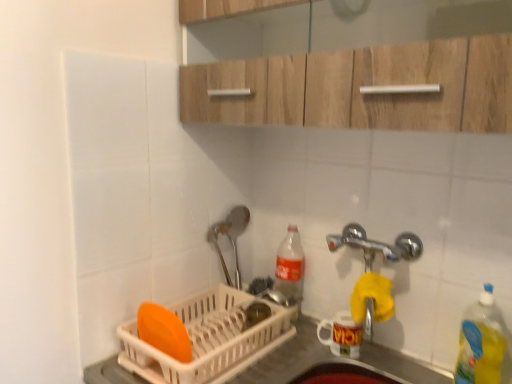
Question: Is yellow translucent bottle at right, the first bottle positioned from the right, outside of white plastic dish rack at lower left?

Choices:
 (A) yes
 (B) no

Answer: (A)

Question: Is yellow translucent bottle at right, placed as the 2th bottle when sorted from back to front, further to the viewer compared to white plastic dish rack at lower left?

Choices:
 (A) yes
 (B) no

Answer: (A)

Question: Is yellow translucent bottle at right, the first bottle positioned from the right, touching white plastic dish rack at lower left?

Choices:
 (A) no
 (B) yes

Answer: (A)

Question: From the image's perspective, does yellow translucent bottle at right, the 2th bottle positioned from the left, appear lower than white plastic dish rack at lower left?

Choices:
 (A) no
 (B) yes

Answer: (A)

Question: Does yellow translucent bottle at right, placed as the 2th bottle when sorted from back to front, have a lesser height compared to white plastic dish rack at lower left?

Choices:
 (A) yes
 (B) no

Answer: (B)

Question: Relative to white plastic dish rack at lower left, is wooden cabinet at upper center in front or behind?

Choices:
 (A) front
 (B) behind

Answer: (A)

Question: From their relative heights in the image, would you say wooden cabinet at upper center is taller or shorter than white plastic dish rack at lower left?

Choices:
 (A) tall
 (B) short

Answer: (A)

Question: Considering the positions of wooden cabinet at upper center and white plastic dish rack at lower left in the image, is wooden cabinet at upper center bigger or smaller than white plastic dish rack at lower left?

Choices:
 (A) big
 (B) small

Answer: (A)

Question: Is wooden cabinet at upper center to the left or to the right of white plastic dish rack at lower left in the image?

Choices:
 (A) left
 (B) right

Answer: (B)

Question: Considering the positions of white plastic dish rack at lower left and yellow translucent bottle at right, the first bottle positioned from the right, in the image, is white plastic dish rack at lower left bigger or smaller than yellow translucent bottle at right, the first bottle positioned from the right,?

Choices:
 (A) small
 (B) big

Answer: (B)

Question: Does point (x=300, y=342) appear closer or farther from the camera than point (x=479, y=379)?

Choices:
 (A) farther
 (B) closer

Answer: (A)

Question: Visually, is white plastic dish rack at lower left positioned to the left or to the right of yellow translucent bottle at right, placed as the 2th bottle when sorted from back to front?

Choices:
 (A) right
 (B) left

Answer: (B)

Question: From the image's perspective, relative to yellow translucent bottle at right, which ranks as the first bottle in front-to-back order, is white plastic dish rack at lower left above or below?

Choices:
 (A) below
 (B) above

Answer: (A)

Question: Do you think yellow translucent bottle at right, placed as the 2th bottle when sorted from back to front, is within white plastic dish rack at lower left, or outside of it?

Choices:
 (A) outside
 (B) inside

Answer: (A)

Question: Relative to white plastic dish rack at lower left, is yellow translucent bottle at right, which ranks as the first bottle in front-to-back order, in front or behind?

Choices:
 (A) front
 (B) behind

Answer: (A)